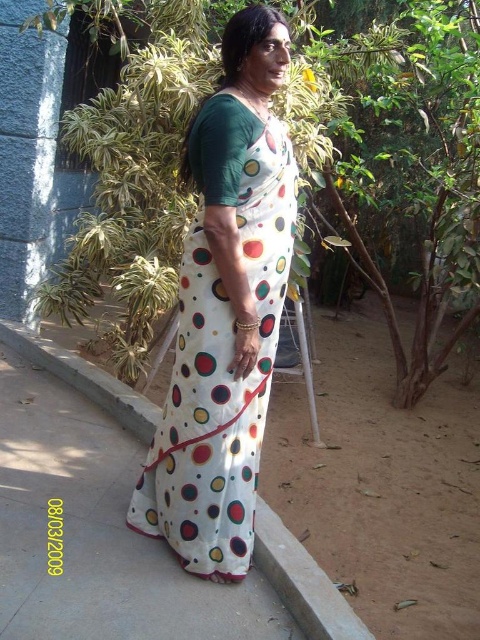
From the picture: You are a photographer trying to capture the woman in the scene. You notice two white fabrics at the center of the image. Which one is closer to the camera, the white dotted fabric dress at center or the white fabric at center?

The white dotted fabric dress at center is in front of the white fabric at center, so it is closer to the camera.

You are a fashion designer observing a woman wearing a white dotted fabric dress at center and a white fabric at center. Which piece of clothing has a wider width?

The white fabric at center has a wider width than the white dotted fabric dress at center.

You are a fashion designer observing the scene. You see a woman wearing a white dotted fabric dress at center and a white fabric at center. Which item of clothing is smaller in size?

The white dotted fabric dress at center has a smaller size compared to the white fabric at center.